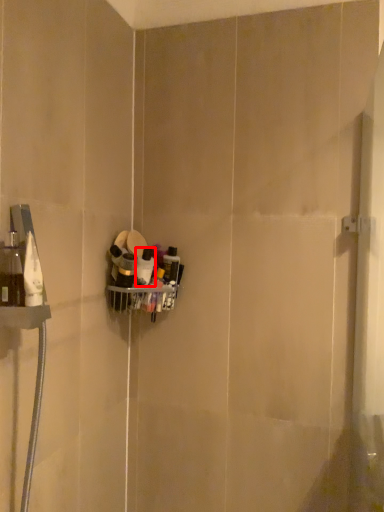
Question: Observing the image, what is the correct spatial positioning of toiletry (annotated by the red box) in reference to toiletry?

Choices:
 (A) right
 (B) left

Answer: (A)